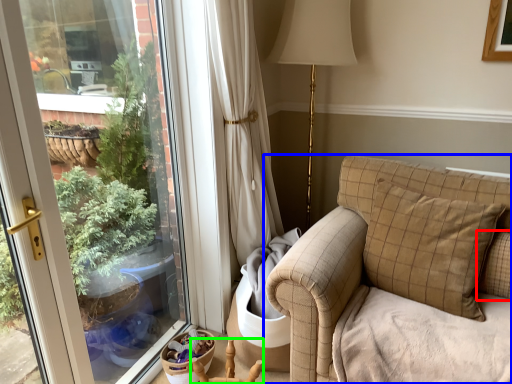
Question: Which object is positioned closest to pillow (highlighted by a red box)? Select from studio couch (highlighted by a blue box) and armchair (highlighted by a green box).

Choices:
 (A) studio couch
 (B) armchair

Answer: (A)